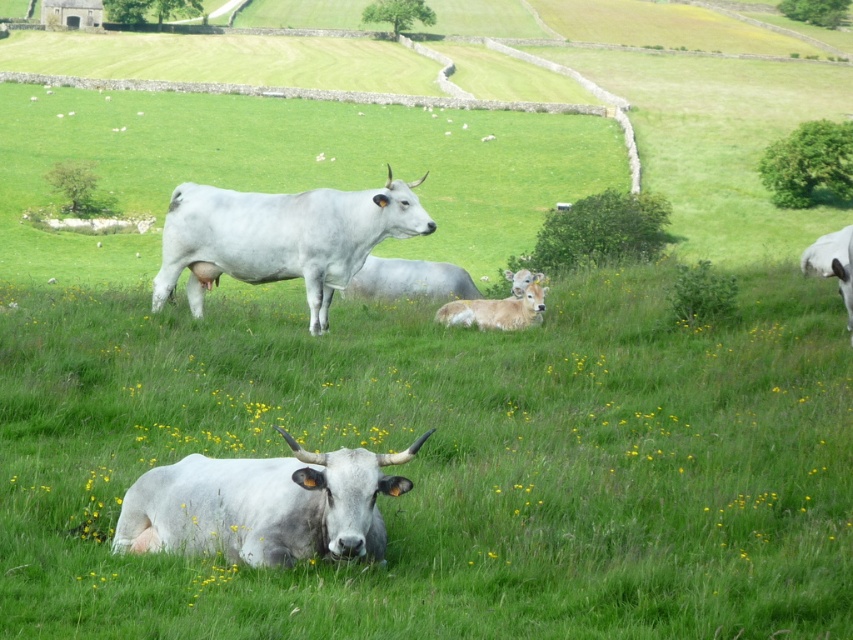
Question: Which object is farther from the camera taking this photo?

Choices:
 (A) green grass at center
 (B) white smooth cow at lower center
 (C) white smooth bull at center
 (D) light brown fur at center

Answer: (D)

Question: Is light brown fur at center below white smooth bull at right?

Choices:
 (A) no
 (B) yes

Answer: (B)

Question: Can you confirm if light brown fur at center is thinner than white smooth bull at right?

Choices:
 (A) yes
 (B) no

Answer: (A)

Question: Which object appears farthest from the camera in this image?

Choices:
 (A) green grass at center
 (B) white smooth bull at center
 (C) white smooth cow at lower center
 (D) light brown fur at center

Answer: (D)

Question: In this image, where is white smooth bull at center located relative to white smooth bull at right?

Choices:
 (A) above
 (B) below

Answer: (A)

Question: Which of the following is the closest to the observer?

Choices:
 (A) [276, 257]
 (B) [355, 476]

Answer: (B)